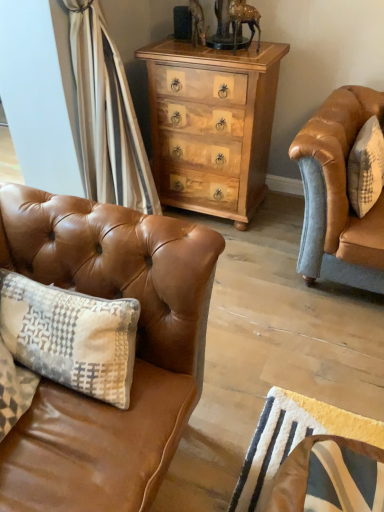
In order to click on free space behind leather swivel chair at lower right in this screenshot , I will do `click(276, 431)`.